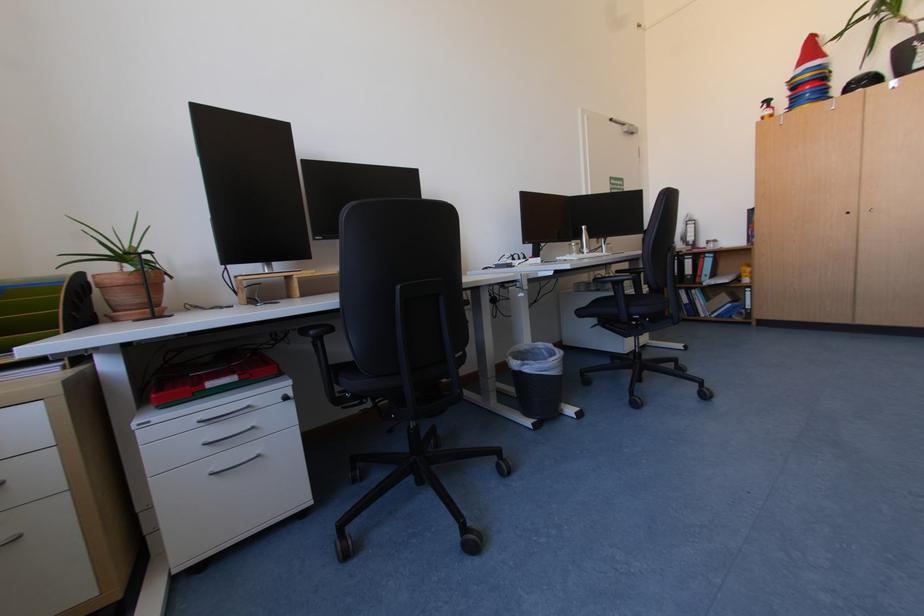
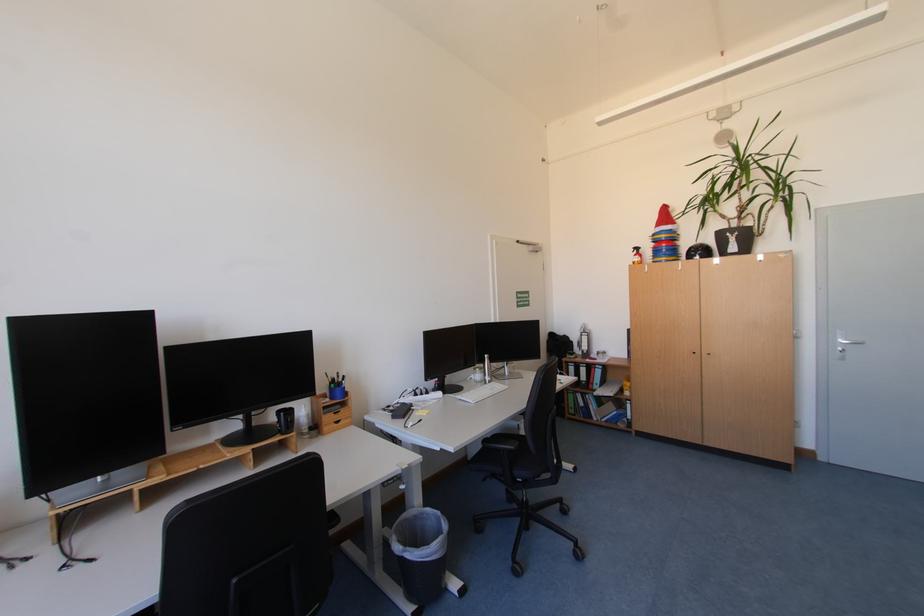
Find the pixel in the second image that matches [529,373] in the first image.

(409, 557)